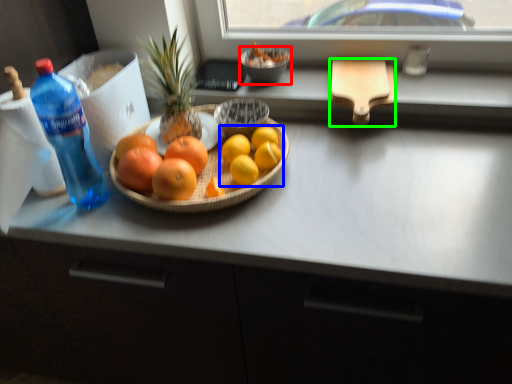
Question: Which object is the farthest from glass bowl (highlighted by a red box)? Choose among these: grapefruit (highlighted by a blue box) or cutting board (highlighted by a green box).

Choices:
 (A) grapefruit
 (B) cutting board

Answer: (A)